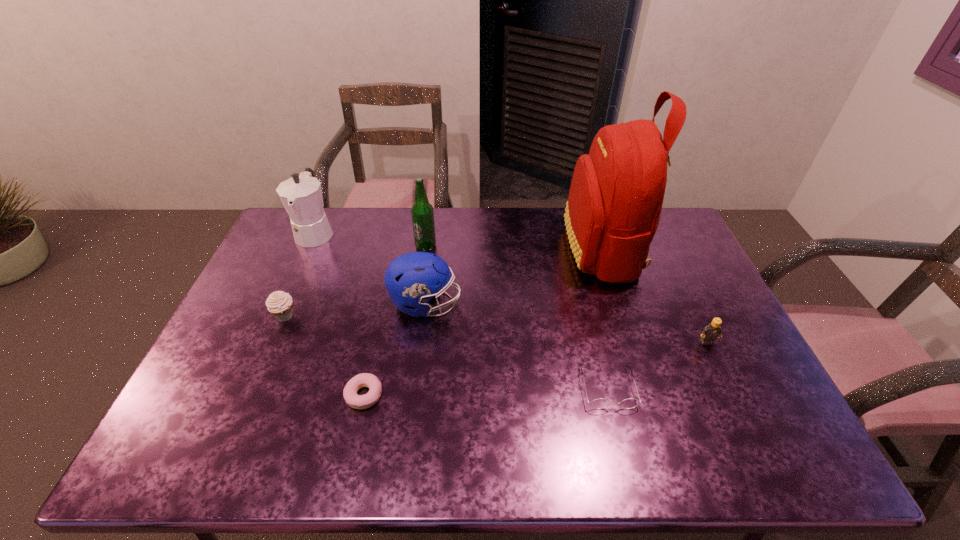
You are a GUI agent. You are given a task and a screenshot of the screen. Output one action in this format:
    pyautogui.click(x=<x>, y=<y>)
    Task: Click on the vacant position located on the front-facing side of the tallest object
    
    Given the screenshot: What is the action you would take?
    pyautogui.click(x=453, y=248)

The image size is (960, 540). Find the location of `free location located on the front-facing side of the tallest object`. free location located on the front-facing side of the tallest object is located at coordinates (456, 248).

The image size is (960, 540). I want to click on vacant space located 0.320m on the label of the beer bottle, so click(x=415, y=323).

Find the location of a particular element. vacant space situated 0.150m at the spout of the coffeepot is located at coordinates (293, 283).

At what (x,y) coordinates should I click in order to perform the action: click on free spot located 0.220m on the front-facing side of the football helmet. Please return your answer as a coordinate pair (x, y). Image resolution: width=960 pixels, height=540 pixels. Looking at the image, I should click on (534, 304).

Where is `free point located 0.160m on the right of the muffin`? The width and height of the screenshot is (960, 540). free point located 0.160m on the right of the muffin is located at coordinates (351, 316).

The image size is (960, 540). In order to click on vacant space located in front of the rightmost object in this screenshot , I will do `click(724, 379)`.

Find the location of `free region located on the front-facing side of the spectacles`. free region located on the front-facing side of the spectacles is located at coordinates (623, 450).

I want to click on vacant point located on the left of the doughnut, so click(322, 395).

Locate an element on the screen. The image size is (960, 540). backpack that is positioned at the far edge is located at coordinates (615, 200).